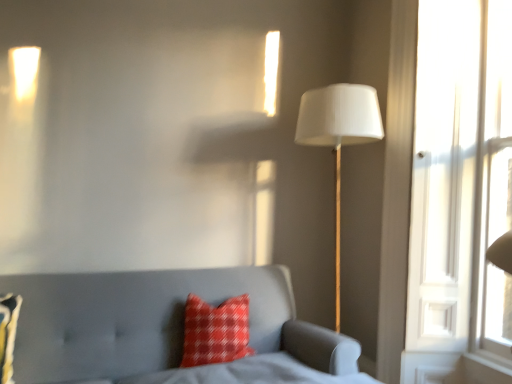
Question: Does point (212, 324) appear closer or farther from the camera than point (335, 236)?

Choices:
 (A) closer
 (B) farther

Answer: (A)

Question: Considering the positions of red plaid pillow at center, acting as the second pillow starting from the left, and white fabric lampshade at right in the image, is red plaid pillow at center, acting as the second pillow starting from the left, bigger or smaller than white fabric lampshade at right?

Choices:
 (A) small
 (B) big

Answer: (A)

Question: Considering the real-world distances, which object is closest to the red plaid pillow at lower left, which is counted as the 2th pillow, starting from the back?

Choices:
 (A) red plaid pillow at center, the 1th pillow from the right
 (B) matte gray sofa at lower left
 (C) white fabric lampshade at right

Answer: (B)

Question: Which object is positioned farthest from the red plaid pillow at lower left, placed as the 1th pillow when sorted from front to back?

Choices:
 (A) matte gray sofa at lower left
 (B) red plaid pillow at center, the second pillow from the front
 (C) white fabric lampshade at right

Answer: (C)